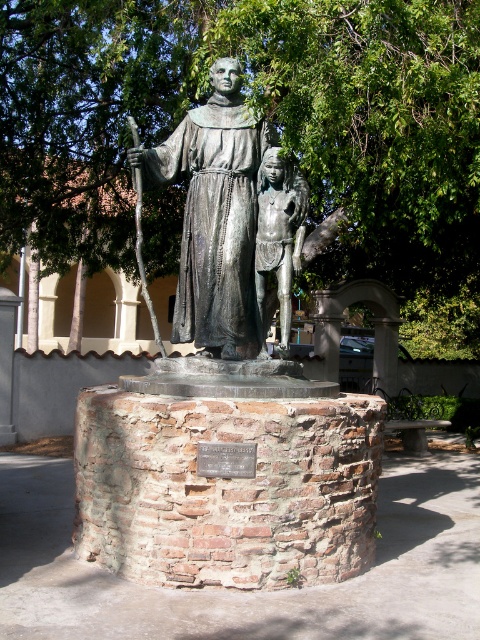
In the scene shown: You are a photographer trying to capture the bronze statue at center without any obstructions. However, there is a green leafy tree at upper center in the way. Can you adjust your position to avoid the tree while still keeping the statue in the frame?

The green leafy tree at upper center is positioned over the bronze statue at center, so moving to the side or adjusting the angle might allow you to capture the statue without the tree obstructing it.

You are standing in front of the bronze statue and want to take a photo of the green leafy tree at upper center. Which direction should you face to capture it in your shot?

The green leafy tree at upper center is located at point 0.192 on the x axis and 0.571 on the y axis, so you should face towards the upper center direction to capture it in your shot.